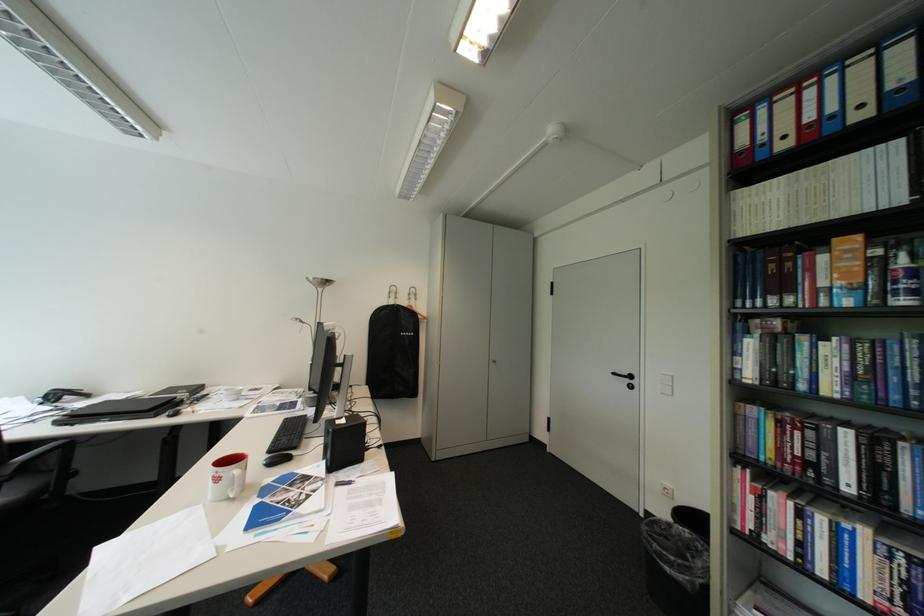
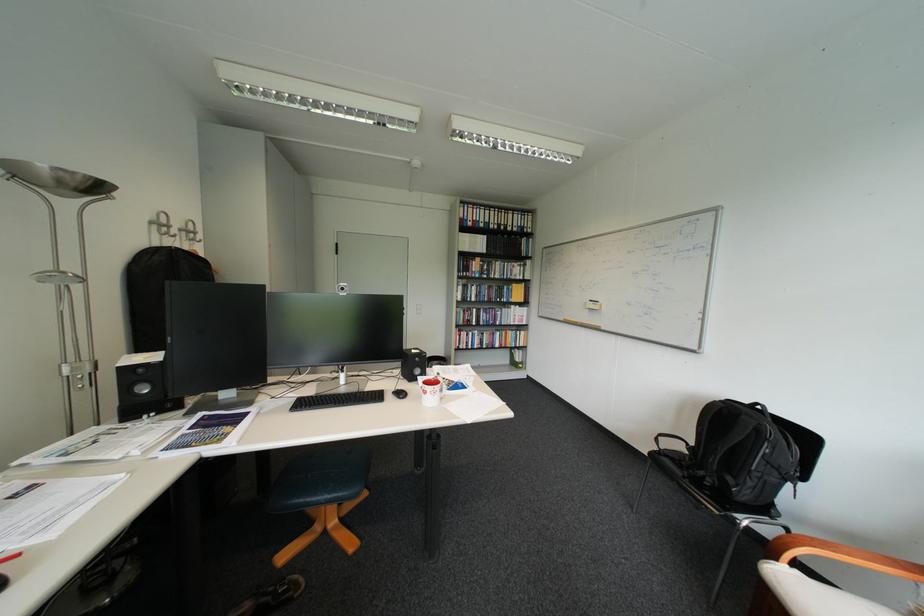
Find the pixel in the second image that matches [408,299] in the first image.

(187, 237)